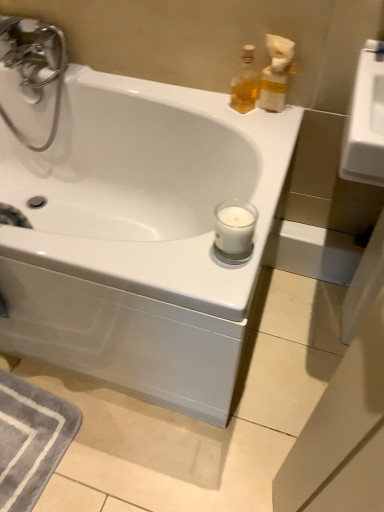
Question: Does white glossy bathtub at center appear on the left side of translucent plastic soap dispenser at upper right, acting as the 2th soap dispenser starting from the left?

Choices:
 (A) no
 (B) yes

Answer: (B)

Question: Considering the relative positions of white glossy bathtub at center and translucent plastic soap dispenser at upper right, the 1th soap dispenser when ordered from right to left, in the image provided, is white glossy bathtub at center to the right of translucent plastic soap dispenser at upper right, the 1th soap dispenser when ordered from right to left, from the viewer's perspective?

Choices:
 (A) yes
 (B) no

Answer: (B)

Question: Can you confirm if white glossy bathtub at center is bigger than translucent plastic soap dispenser at upper right, acting as the 2th soap dispenser starting from the left?

Choices:
 (A) no
 (B) yes

Answer: (B)

Question: Does white glossy bathtub at center come in front of translucent plastic soap dispenser at upper right, the 1th soap dispenser when ordered from right to left?

Choices:
 (A) yes
 (B) no

Answer: (A)

Question: From a real-world perspective, does white glossy bathtub at center stand above translucent plastic soap dispenser at upper right, the 1th soap dispenser when ordered from right to left?

Choices:
 (A) yes
 (B) no

Answer: (B)

Question: Is point (248, 76) positioned closer to the camera than point (158, 177)?

Choices:
 (A) closer
 (B) farther

Answer: (A)

Question: Considering the positions of translucent glass bottle at upper right, the first soap dispenser in the left-to-right sequence, and white glossy bathtub at center in the image, is translucent glass bottle at upper right, the first soap dispenser in the left-to-right sequence, taller or shorter than white glossy bathtub at center?

Choices:
 (A) tall
 (B) short

Answer: (B)

Question: Is translucent glass bottle at upper right, the first soap dispenser in the left-to-right sequence, situated inside white glossy bathtub at center or outside?

Choices:
 (A) inside
 (B) outside

Answer: (B)

Question: From a real-world perspective, is translucent glass bottle at upper right, the first soap dispenser in the left-to-right sequence, above or below white glossy bathtub at center?

Choices:
 (A) below
 (B) above

Answer: (B)

Question: Is translucent glass bottle at upper right, placed as the 2th soap dispenser when sorted from right to left, taller or shorter than translucent plastic soap dispenser at upper right, the 1th soap dispenser when ordered from right to left?

Choices:
 (A) short
 (B) tall

Answer: (A)

Question: Would you say translucent glass bottle at upper right, placed as the 2th soap dispenser when sorted from right to left, is to the left or to the right of translucent plastic soap dispenser at upper right, acting as the 2th soap dispenser starting from the left, in the picture?

Choices:
 (A) right
 (B) left

Answer: (B)

Question: Does point (248, 74) appear closer or farther from the camera than point (268, 68)?

Choices:
 (A) closer
 (B) farther

Answer: (B)

Question: From the image's perspective, relative to translucent plastic soap dispenser at upper right, the 1th soap dispenser when ordered from right to left, is translucent glass bottle at upper right, the first soap dispenser in the left-to-right sequence, above or below?

Choices:
 (A) above
 (B) below

Answer: (A)

Question: In the image, is white glossy bathtub at center positioned in front of or behind translucent plastic soap dispenser at upper right, acting as the 2th soap dispenser starting from the left?

Choices:
 (A) front
 (B) behind

Answer: (A)

Question: From a real-world perspective, is white glossy bathtub at center physically located above or below translucent plastic soap dispenser at upper right, the 1th soap dispenser when ordered from right to left?

Choices:
 (A) below
 (B) above

Answer: (A)